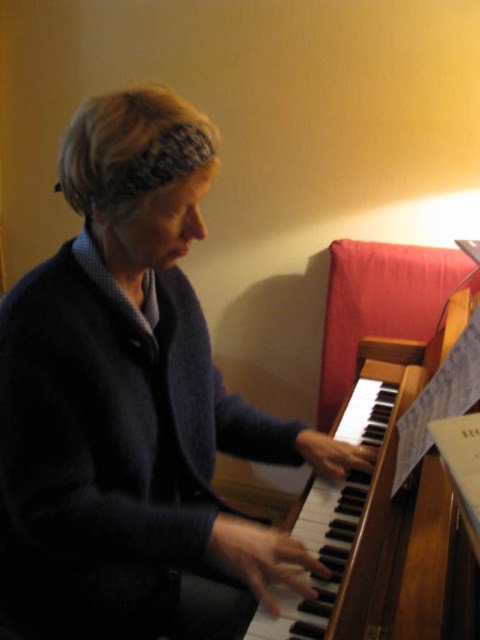
Question: Can you confirm if dark blue sweater at center is bigger than wooden harpsichord at center?

Choices:
 (A) no
 (B) yes

Answer: (A)

Question: Which of the following is the closest to the observer?

Choices:
 (A) dark blue sweater at center
 (B) wooden harpsichord at center

Answer: (B)

Question: Which point appears closest to the camera in this image?

Choices:
 (A) (120, 291)
 (B) (421, 595)

Answer: (B)

Question: Is dark blue sweater at center bigger than wooden harpsichord at center?

Choices:
 (A) yes
 (B) no

Answer: (B)

Question: Is dark blue sweater at center behind wooden harpsichord at center?

Choices:
 (A) no
 (B) yes

Answer: (B)